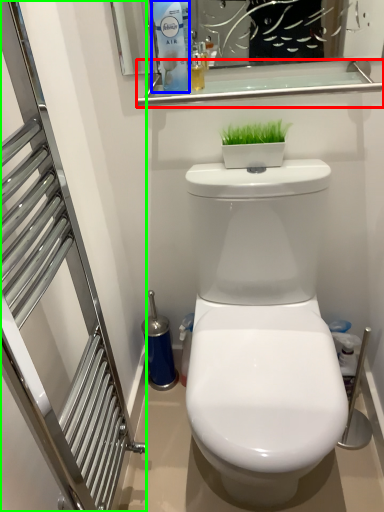
Question: Which object is positioned closest to balustrade (highlighted by a red box)? Select from cleaning product (highlighted by a blue box) and screen door (highlighted by a green box).

Choices:
 (A) cleaning product
 (B) screen door

Answer: (A)